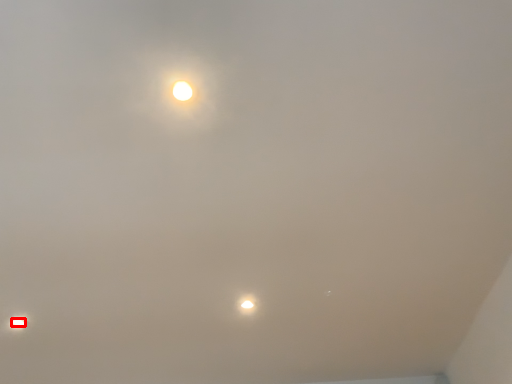
Question: From the image's perspective, considering the relative positions of lamp (annotated by the red box) and lamp in the image provided, where is lamp (annotated by the red box) located with respect to the staircase?

Choices:
 (A) below
 (B) above

Answer: (A)